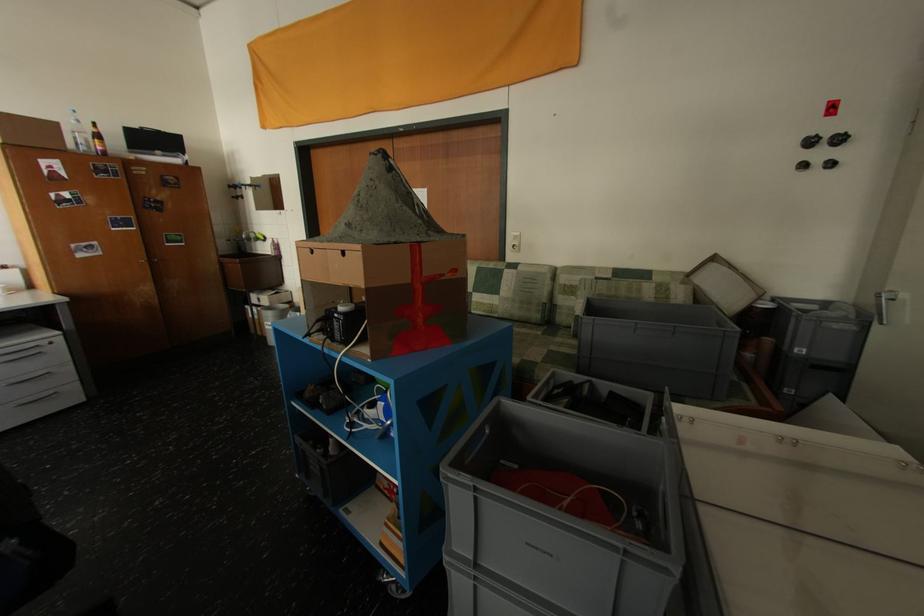
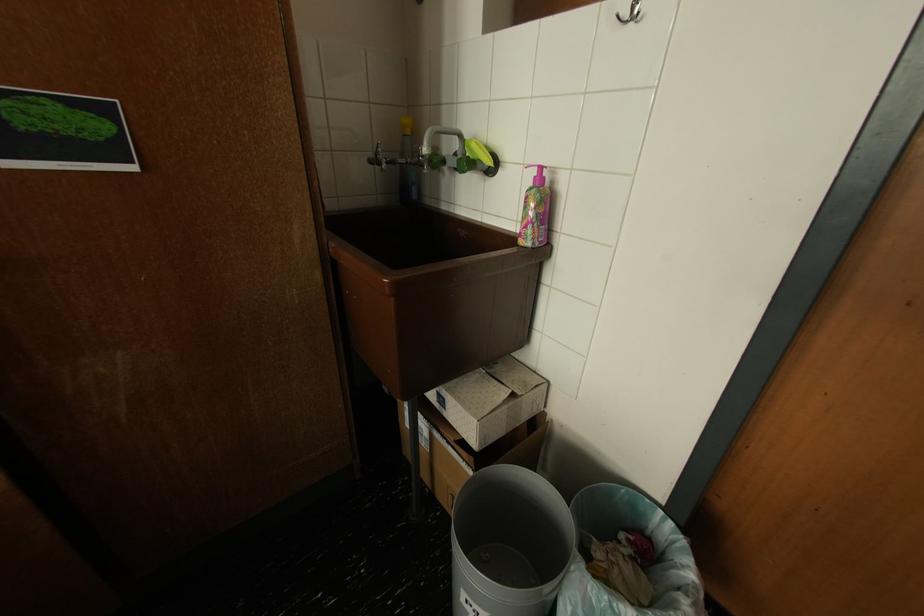
The point at (258, 240) is marked in the first image. Where is the corresponding point in the second image?

(445, 163)